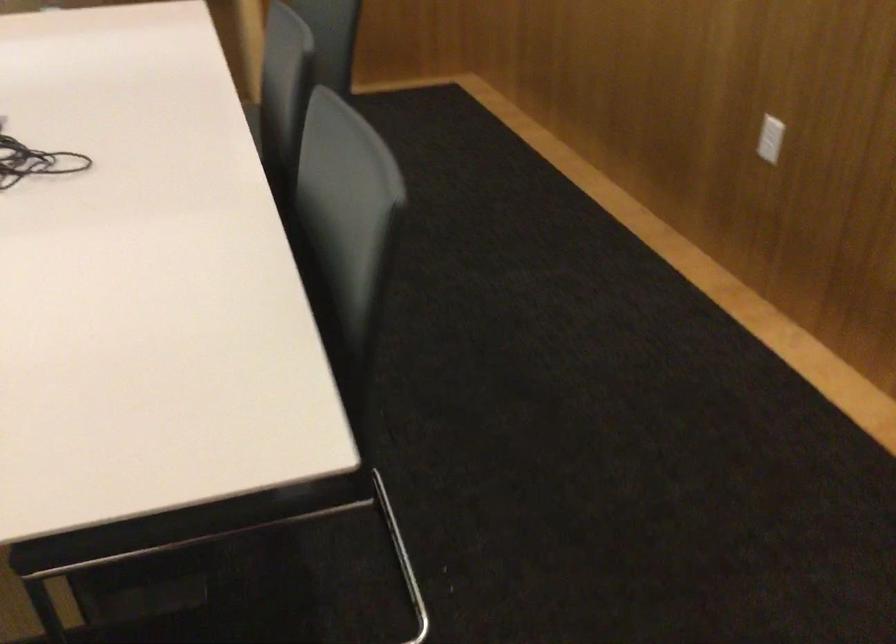
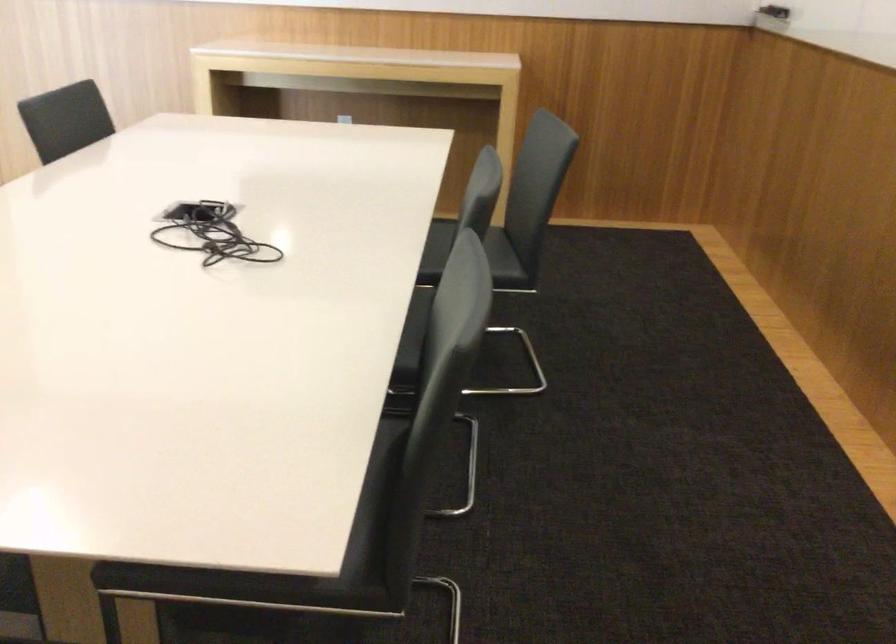
Locate, in the second image, the point that corresponds to the point at 325,453 in the first image.

(311, 558)